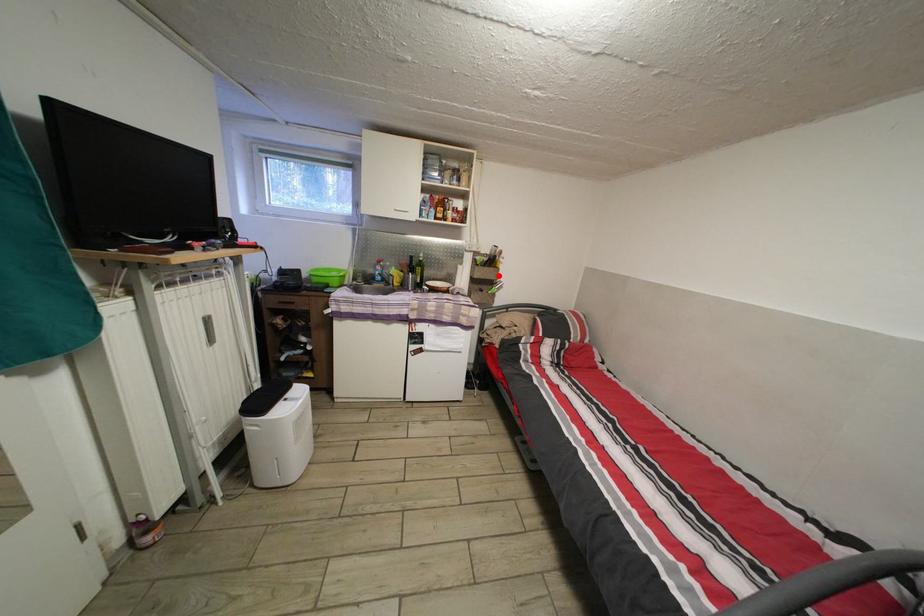
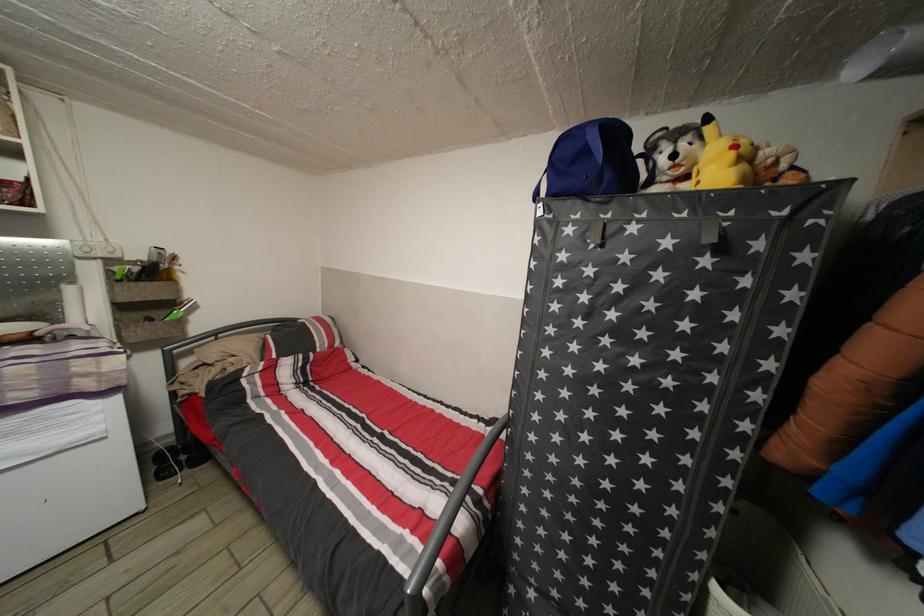
Find the pixel in the second image that matches the highlighted location in the first image.

(164, 291)